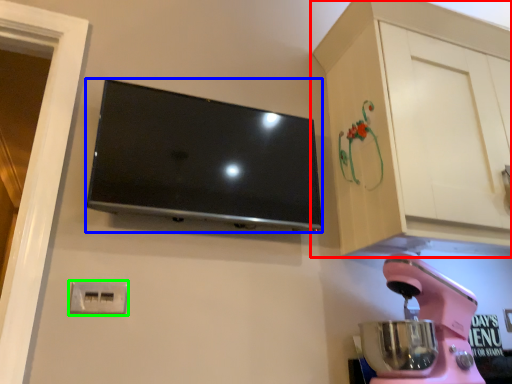
Question: Which object is positioned closest to cabinetry (highlighted by a red box)? Select from television (highlighted by a blue box) and electric outlet (highlighted by a green box).

Choices:
 (A) television
 (B) electric outlet

Answer: (A)